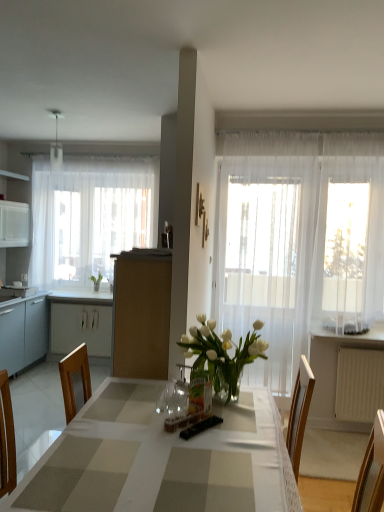
What are the coordinates of `space that is in front of translucent glass vase at center` in the screenshot? It's located at (207, 430).